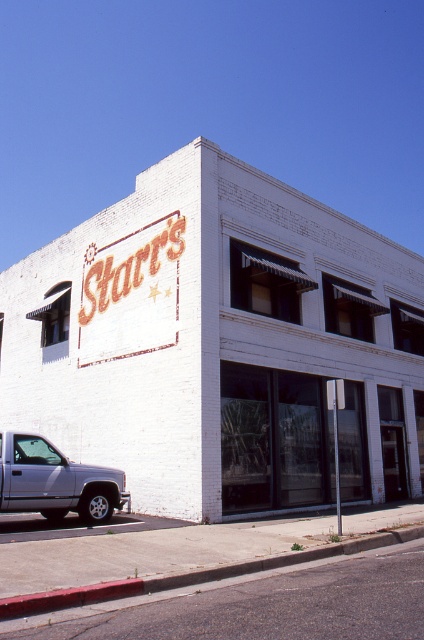
Question: Observing the image, what is the correct spatial positioning of silver metallic truck at lower left in reference to concrete curb at lower center?

Choices:
 (A) above
 (B) below

Answer: (B)

Question: Which of the following is the closest to the observer?

Choices:
 (A) white brick building at center
 (B) silver metallic truck at lower left
 (C) concrete curb at lower center

Answer: (C)

Question: Does white brick building at center have a lesser width compared to concrete curb at lower center?

Choices:
 (A) no
 (B) yes

Answer: (A)

Question: Among these points, which one is nearest to the camera?

Choices:
 (A) (136, 589)
 (B) (418, 340)
 (C) (113, 499)

Answer: (A)

Question: Which object is the closest to the silver metallic truck at lower left?

Choices:
 (A) concrete curb at lower center
 (B) white brick building at center

Answer: (B)

Question: From the image, what is the correct spatial relationship of silver metallic truck at lower left in relation to concrete curb at lower center?

Choices:
 (A) right
 (B) left

Answer: (B)